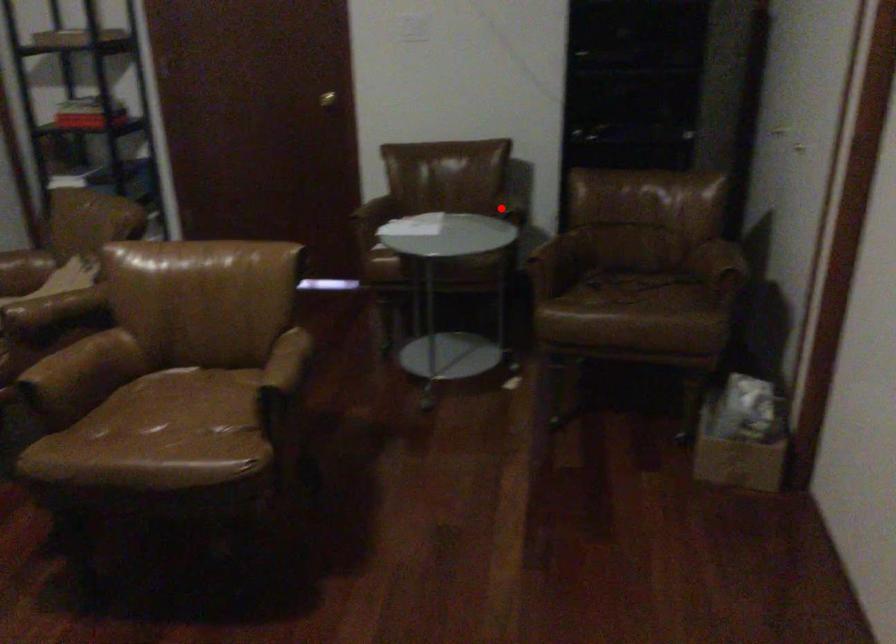
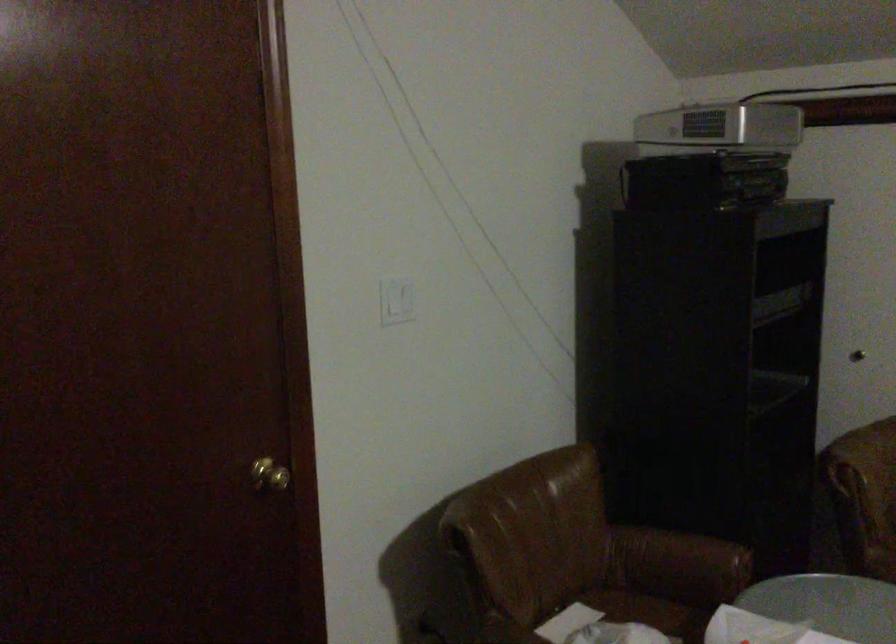
Find the pixel in the second image that matches the highlighted location in the first image.

(679, 559)